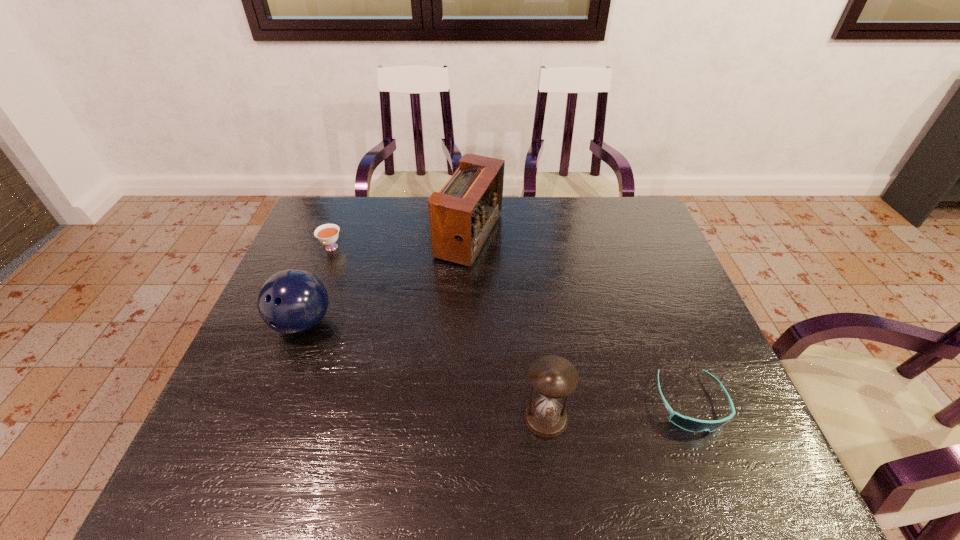
Where is `radio receiver`? radio receiver is located at coordinates (461, 216).

What are the coordinates of `the tallest object` in the screenshot? It's located at (461, 216).

The image size is (960, 540). Find the location of `the third farthest object`. the third farthest object is located at coordinates (292, 301).

Where is `the fourth object from left to right`? This screenshot has width=960, height=540. the fourth object from left to right is located at coordinates (553, 377).

At what (x,y) coordinates should I click in order to perform the action: click on teacup. Please return your answer as a coordinate pair (x, y). Image resolution: width=960 pixels, height=540 pixels. Looking at the image, I should click on (327, 234).

Locate an element on the screen. This screenshot has height=540, width=960. the rightmost object is located at coordinates (687, 423).

You are a GUI agent. You are given a task and a screenshot of the screen. Output one action in this format:
    pyautogui.click(x=<x>, y=<y>)
    Task: Click on the sunglasses
    The height and width of the screenshot is (540, 960).
    Given the screenshot: What is the action you would take?
    pyautogui.click(x=687, y=423)

At what (x,y) coordinates should I click in order to perform the action: click on vacant space located on the right of the third object from left to right. Please return your answer as a coordinate pair (x, y). The image size is (960, 540). Looking at the image, I should click on (562, 236).

Locate an element on the screen. The width and height of the screenshot is (960, 540). vacant region located on the surface of the bowling ball near the finger holes is located at coordinates (263, 424).

What are the coordinates of `vacant space located 0.120m on the left of the fourth object from left to right` in the screenshot? It's located at (467, 418).